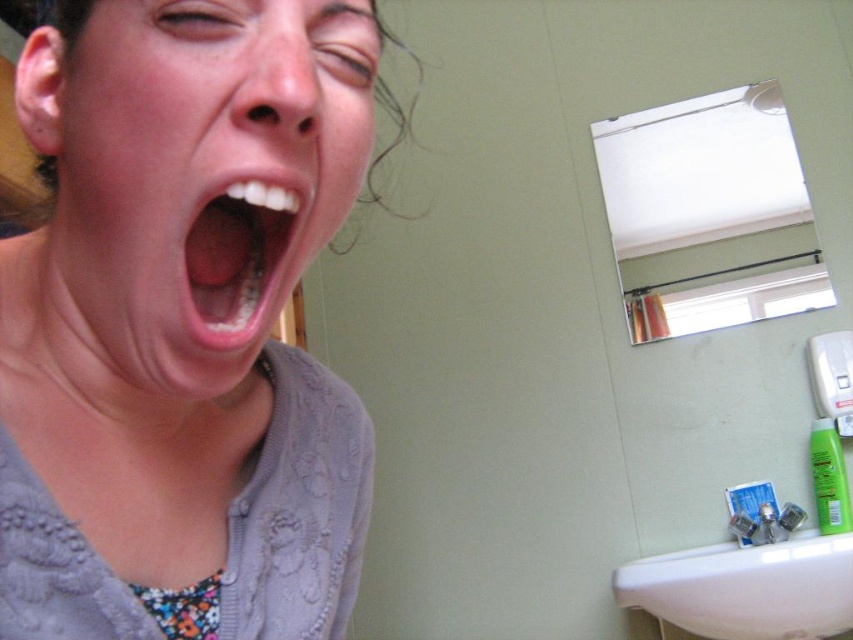
Between point (233, 262) and point (244, 268), which one is positioned in front?

Positioned in front is point (233, 262).

What do you see at coordinates (181, 314) in the screenshot? The width and height of the screenshot is (853, 640). I see `matte gray sweater at center` at bounding box center [181, 314].

You are a GUI agent. You are given a task and a screenshot of the screen. Output one action in this format:
    pyautogui.click(x=<x>, y=<y>)
    Task: Click on the matte gray sweater at center
    
    Given the screenshot: What is the action you would take?
    pyautogui.click(x=181, y=314)

Is white ceramic sink at lower right to the left of pink glossy lips at center from the viewer's perspective?

Incorrect, white ceramic sink at lower right is not on the left side of pink glossy lips at center.

Is point (849, 628) behind point (257, 259)?

Yes, point (849, 628) is behind point (257, 259).

What are the coordinates of `white ceramic sink at lower right` in the screenshot? It's located at (746, 588).

From the picture: Who is shorter, pink flesh-colored face at center or blue matte toothpaste at sink right?

blue matte toothpaste at sink right is shorter.

Between pink flesh-colored face at center and blue matte toothpaste at sink right, which one appears on the left side from the viewer's perspective?

pink flesh-colored face at center is more to the left.

Find the location of a particular element. pink flesh-colored face at center is located at coordinates (202, 176).